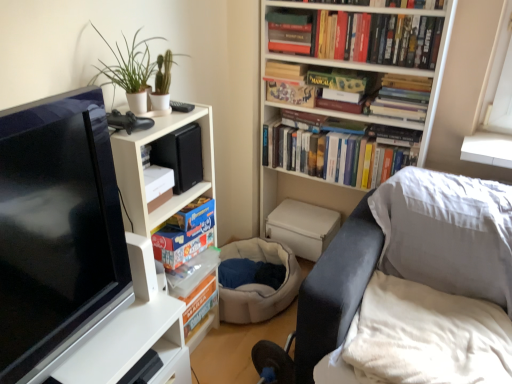
Locate an element on the screen. This screenshot has width=512, height=384. vacant area on top of matt black board game at upper center, the 4th book from the bottom (from a real-world perspective) is located at coordinates (292, 82).